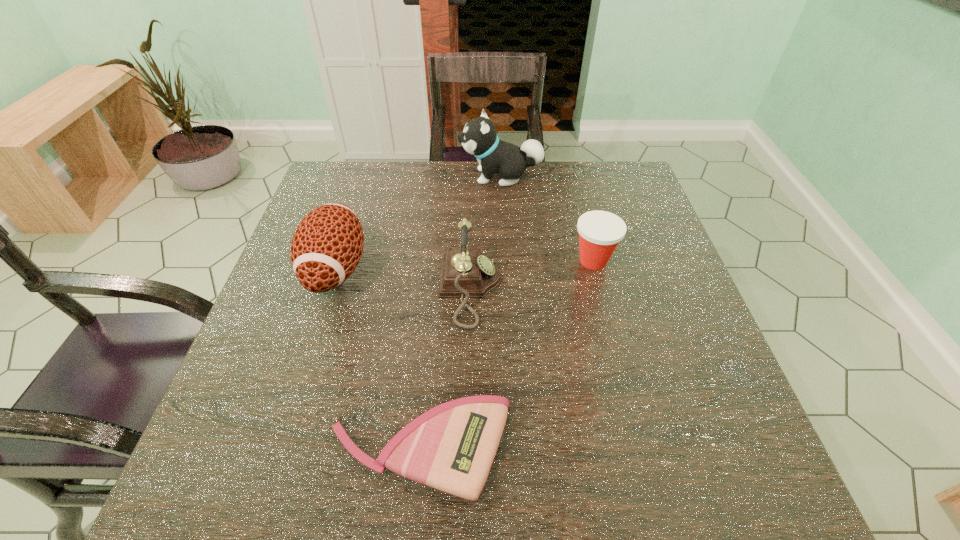
This screenshot has width=960, height=540. In the image, there is a desktop. Find the location of `vacant area at the near edge`. vacant area at the near edge is located at coordinates (548, 481).

This screenshot has width=960, height=540. In order to click on vacant area at the left edge of the desktop in this screenshot , I will do `click(292, 378)`.

The image size is (960, 540). I want to click on blank space at the right edge, so click(636, 223).

Where is `vacant space at the near left corner`? The image size is (960, 540). vacant space at the near left corner is located at coordinates (276, 494).

Find the location of a particular element. This screenshot has height=540, width=960. free space at the far right corner of the desktop is located at coordinates (622, 202).

I want to click on vacant area that lies between the wristlet and the puppy, so click(x=460, y=313).

Identify the location of vacant point located between the telephone and the farthest object. (486, 233).

Identify the location of free space between the wristlet and the puppy. This screenshot has width=960, height=540. (460, 313).

The height and width of the screenshot is (540, 960). Identify the location of vacant area that lies between the shortest object and the rightmost object. (507, 355).

This screenshot has width=960, height=540. I want to click on vacant area between the football and the puppy, so (x=419, y=222).